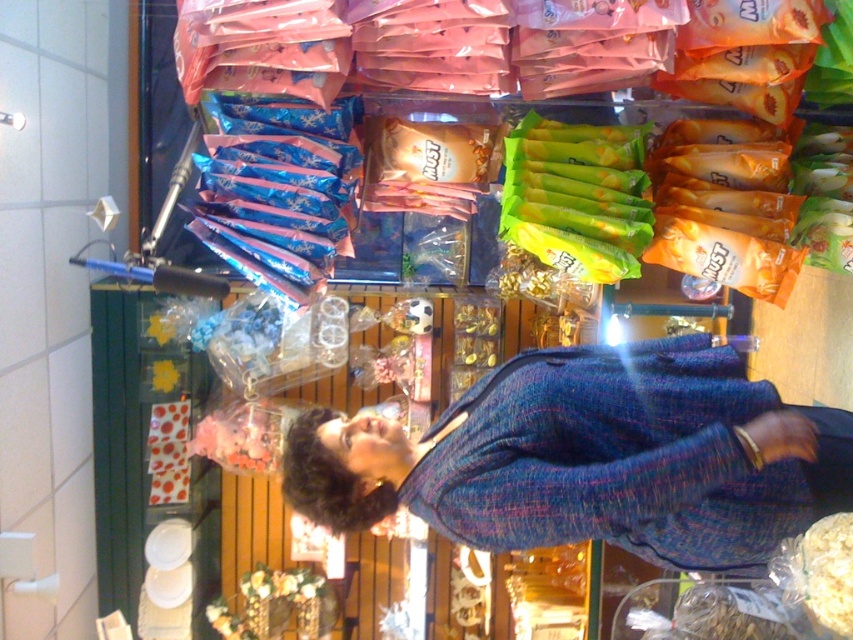
Question: Is blue tweed jacket at center to the left of green matte candy at center from the viewer's perspective?

Choices:
 (A) yes
 (B) no

Answer: (A)

Question: Is blue tweed jacket at center closer to camera compared to green matte candy at center?

Choices:
 (A) yes
 (B) no

Answer: (A)

Question: Does blue tweed jacket at center have a greater width compared to green matte candy at center?

Choices:
 (A) yes
 (B) no

Answer: (A)